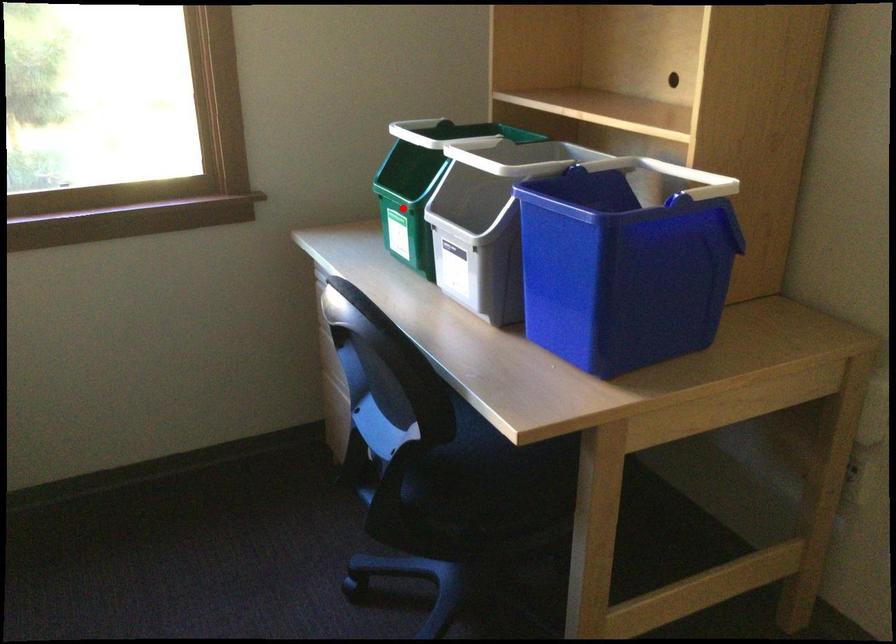
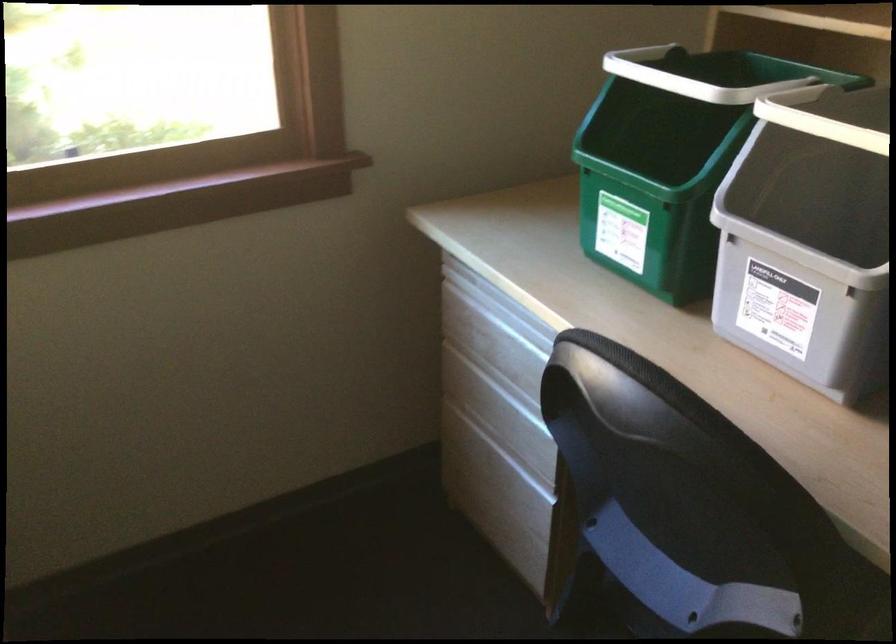
Question: A red point is marked in image1. In image2, is the corresponding 3D point closer to the camera or farther? Reply with the corresponding letter.

Choices:
 (A) The corresponding 3D point is closer.
 (B) The corresponding 3D point is farther.

Answer: (A)